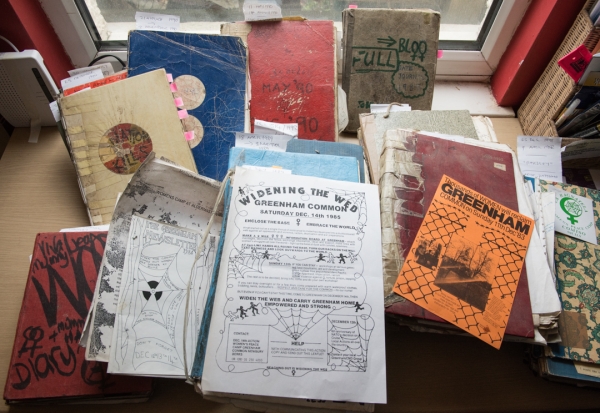
Where is `post-it`? This screenshot has width=600, height=413. post-it is located at coordinates (550, 168).